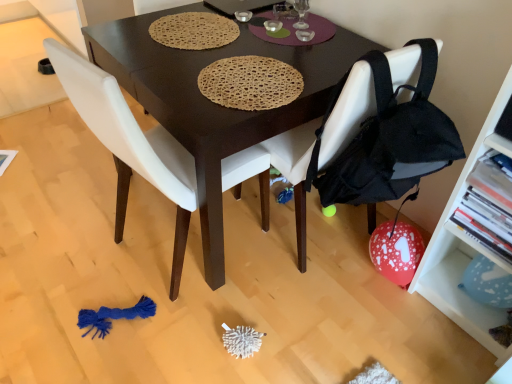
This screenshot has height=384, width=512. Identify the location of vacant space in front of white matte chair at center, which ranks as the second chair in right-to-left order. (170, 336).